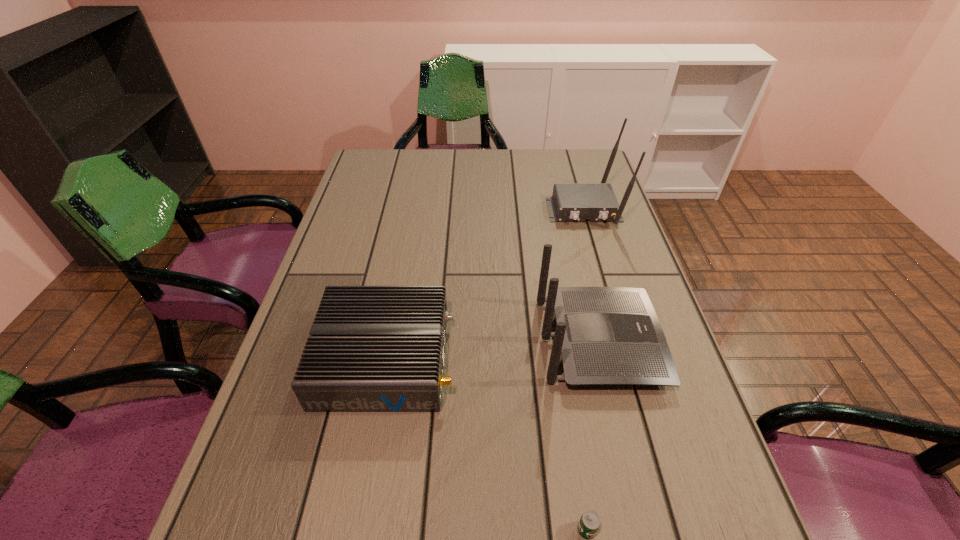
Locate an element on the screen. router identified as the closest to the leftmost router is located at coordinates (606, 335).

Where is `router that stands as the closest to the nearest object`? The height and width of the screenshot is (540, 960). router that stands as the closest to the nearest object is located at coordinates (606, 335).

Find the location of a particular element. The width and height of the screenshot is (960, 540). vacant point that satisfies the following two spatial constraints: 1. on the back of the tallest object to connect cables; 2. on the back panel of the second shortest object is located at coordinates (627, 358).